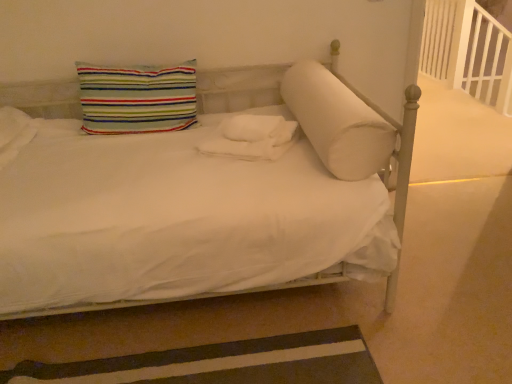
What do you see at coordinates (468, 51) in the screenshot? I see `white wooden balustrade at upper right` at bounding box center [468, 51].

Find the location of a particular element. This screenshot has width=512, height=384. white wooden balustrade at upper right is located at coordinates (468, 51).

Find the location of a particular element. white soft cylindrical pillow at center, the 1th pillow positioned from the right is located at coordinates (337, 122).

The height and width of the screenshot is (384, 512). Identify the location of striped fabric pillow at upper left, the 2th pillow when ordered from right to left. (137, 98).

The height and width of the screenshot is (384, 512). I want to click on brown striped rug at lower left, so click(223, 363).

What is the approximate height of white fluffy blanket at center?

The height of white fluffy blanket at center is 5.38 inches.

Where is `white wooden balustrade at upper right`? white wooden balustrade at upper right is located at coordinates (468, 51).

What's the angular difference between white fluffy blanket at center and striped fabric pillow at upper left, the first pillow from the left,'s facing directions?

The facing directions of white fluffy blanket at center and striped fabric pillow at upper left, the first pillow from the left, are 2.56 degrees apart.

Does white fluffy blanket at center have a smaller size compared to striped fabric pillow at upper left, the 2th pillow when ordered from right to left?

Correct, white fluffy blanket at center occupies less space than striped fabric pillow at upper left, the 2th pillow when ordered from right to left.

How distant is white fluffy blanket at center from striped fabric pillow at upper left, the first pillow from the left?

17.06 inches.

From the image's perspective, between white fluffy blanket at center and striped fabric pillow at upper left, the first pillow from the left, who is located below?

white fluffy blanket at center.

Between point (351, 151) and point (173, 349), which one is positioned behind?

The point (173, 349) is behind.

Based on their sizes in the image, would you say white soft cylindrical pillow at center, the 1th pillow positioned from the right, is bigger or smaller than brown striped rug at lower left?

Considering their sizes, white soft cylindrical pillow at center, the 1th pillow positioned from the right, takes up more space than brown striped rug at lower left.

Locate an element on the screen. The height and width of the screenshot is (384, 512). pillow that is the 1st one when counting backward from the brown striped rug at lower left is located at coordinates (337, 122).

Is striped fabric pillow at upper left, the first pillow from the left, positioned beyond the bounds of white soft cylindrical pillow at center, the 2th pillow viewed from the left?

striped fabric pillow at upper left, the first pillow from the left, lies outside white soft cylindrical pillow at center, the 2th pillow viewed from the left,'s area.

Based on the photo, how many degrees apart are the facing directions of striped fabric pillow at upper left, the first pillow from the left, and white soft cylindrical pillow at center, the 1th pillow positioned from the right?

striped fabric pillow at upper left, the first pillow from the left, and white soft cylindrical pillow at center, the 1th pillow positioned from the right, are facing 2.56 degrees away from each other.

From a real-world perspective, which is physically below, striped fabric pillow at upper left, the 2th pillow when ordered from right to left, or white soft cylindrical pillow at center, the 1th pillow positioned from the right?

white soft cylindrical pillow at center, the 1th pillow positioned from the right, from a real-world perspective.

Is white wooden balustrade at upper right positioned behind striped fabric pillow at upper left, the first pillow from the left?

Yes, white wooden balustrade at upper right is further from the viewer.

Which of these two, white wooden balustrade at upper right or striped fabric pillow at upper left, the 2th pillow when ordered from right to left, stands shorter?

striped fabric pillow at upper left, the 2th pillow when ordered from right to left.

From a real-world perspective, which object rests below the other?

white wooden balustrade at upper right, from a real-world perspective.

Locate an element on the screen. This screenshot has width=512, height=384. balustrade below the striped fabric pillow at upper left, the 2th pillow when ordered from right to left (from a real-world perspective) is located at coordinates (468, 51).

Does brown striped rug at lower left lie in front of white fluffy blanket at center?

Yes, it is.

Visually, is brown striped rug at lower left positioned to the left or to the right of white fluffy blanket at center?

brown striped rug at lower left is positioned on white fluffy blanket at center's left side.

Can we say brown striped rug at lower left lies outside white fluffy blanket at center?

Yes, brown striped rug at lower left is located beyond the bounds of white fluffy blanket at center.

In the scene shown: Between white wooden balustrade at upper right and white fluffy blanket at center, which one appears on the right side from the viewer's perspective?

white wooden balustrade at upper right.

Identify the location of material located below the white wooden balustrade at upper right (from the image's perspective). click(x=252, y=137).

Consider the image. Is there a large distance between white wooden balustrade at upper right and white fluffy blanket at center?

Absolutely, white wooden balustrade at upper right is distant from white fluffy blanket at center.

Is white wooden balustrade at upper right surrounding white fluffy blanket at center?

Actually, white fluffy blanket at center is outside white wooden balustrade at upper right.

Considering the positions of objects white fluffy blanket at center and white soft cylindrical pillow at center, the 1th pillow positioned from the right, in the image provided, who is in front, white fluffy blanket at center or white soft cylindrical pillow at center, the 1th pillow positioned from the right,?

white soft cylindrical pillow at center, the 1th pillow positioned from the right, is in front.

Is white fluffy blanket at center far from white soft cylindrical pillow at center, the 1th pillow positioned from the right?

No, there isn't a large distance between white fluffy blanket at center and white soft cylindrical pillow at center, the 1th pillow positioned from the right.

Is point (246, 151) positioned behind point (348, 139)?

Yes.

From a real-world perspective, which is physically below, white fluffy blanket at center or white soft cylindrical pillow at center, the 1th pillow positioned from the right?

white fluffy blanket at center, from a real-world perspective.

Identify the location of pillow on the left of white fluffy blanket at center. [x=137, y=98].

Where is `pillow on the right of brown striped rug at lower left`? The width and height of the screenshot is (512, 384). pillow on the right of brown striped rug at lower left is located at coordinates (337, 122).

Which object lies nearer to the anchor point striped fabric pillow at upper left, the 2th pillow when ordered from right to left, white soft cylindrical pillow at center, the 1th pillow positioned from the right, or white fluffy blanket at center?

The object closer to striped fabric pillow at upper left, the 2th pillow when ordered from right to left, is white fluffy blanket at center.

In the scene shown: Looking at the image, which one is located closer to white fluffy blanket at center, brown striped rug at lower left or white wooden balustrade at upper right?

Among the two, brown striped rug at lower left is located nearer to white fluffy blanket at center.

Considering their positions, is striped fabric pillow at upper left, the first pillow from the left, positioned closer to white soft cylindrical pillow at center, the 1th pillow positioned from the right, than brown striped rug at lower left?

Based on the image, striped fabric pillow at upper left, the first pillow from the left, appears to be nearer to white soft cylindrical pillow at center, the 1th pillow positioned from the right.

Based on their spatial positions, is white soft cylindrical pillow at center, the 2th pillow viewed from the left, or brown striped rug at lower left closer to white fluffy blanket at center?

Among the two, white soft cylindrical pillow at center, the 2th pillow viewed from the left, is located nearer to white fluffy blanket at center.

Looking at the image, which one is located closer to white soft cylindrical pillow at center, the 2th pillow viewed from the left, brown striped rug at lower left or white wooden balustrade at upper right?

brown striped rug at lower left lies closer to white soft cylindrical pillow at center, the 2th pillow viewed from the left, than the other object.

Based on the photo, estimate the real-world distances between objects in this image. Which object is further from white soft cylindrical pillow at center, the 2th pillow viewed from the left, white fluffy blanket at center or white wooden balustrade at upper right?

white wooden balustrade at upper right is positioned further to the anchor white soft cylindrical pillow at center, the 2th pillow viewed from the left.

Looking at the image, which one is located further to white wooden balustrade at upper right, brown striped rug at lower left or white fluffy blanket at center?

The object further to white wooden balustrade at upper right is brown striped rug at lower left.

Based on their spatial positions, is striped fabric pillow at upper left, the first pillow from the left, or white wooden balustrade at upper right further from brown striped rug at lower left?

Based on the image, white wooden balustrade at upper right appears to be further to brown striped rug at lower left.

The image size is (512, 384). I want to click on material between striped fabric pillow at upper left, the 2th pillow when ordered from right to left, and brown striped rug at lower left vertically, so click(252, 137).

Where is `material located between white soft cylindrical pillow at center, the 2th pillow viewed from the left, and white wooden balustrade at upper right in the depth direction`? material located between white soft cylindrical pillow at center, the 2th pillow viewed from the left, and white wooden balustrade at upper right in the depth direction is located at coordinates (252, 137).

Find the location of a particular element. pillow between striped fabric pillow at upper left, the 2th pillow when ordered from right to left, and brown striped rug at lower left in the up-down direction is located at coordinates (337, 122).

I want to click on pillow between striped fabric pillow at upper left, the first pillow from the left, and white wooden balustrade at upper right, so point(337,122).